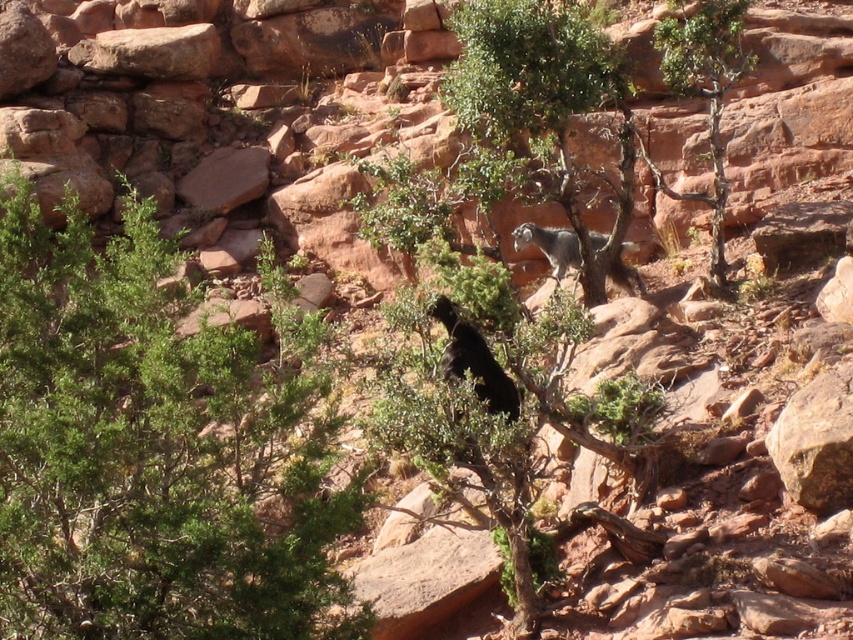
A hiker is standing at the base of the green leafy shrub at left and wants to throw a rock to hit a target located at the base of the dark object perched in the tree. What is the minimum distance the hiker needs to throw the rock?

The minimum distance the hiker needs to throw the rock is 10.39 meters, as the green leafy shrub at left and the dark object perched in the tree are 10.39 meters apart.

You are a hiker trying to navigate through the rugged terrain. You see a green leafy shrub at left and a green leafy tree at center. Which one should you approach first if you want to reach the tree at center without getting too close to the shrub?

You should approach the green leafy tree at center directly since it is farther away from you than the green leafy shrub at left, allowing you to bypass the shrub while moving toward the tree.